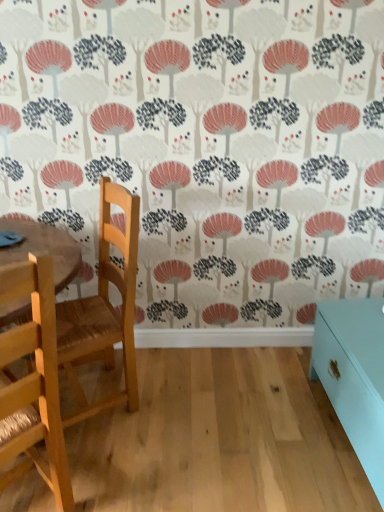
Question: Can you confirm if teal glossy cabinet at lower right is bigger than light wood chair at left, arranged as the 1th chair when viewed from the front?

Choices:
 (A) no
 (B) yes

Answer: (B)

Question: From the image's perspective, would you say teal glossy cabinet at lower right is positioned over light wood chair at left, arranged as the 1th chair when viewed from the front?

Choices:
 (A) yes
 (B) no

Answer: (B)

Question: Is teal glossy cabinet at lower right at the right side of light wood chair at left, the second chair positioned from the back?

Choices:
 (A) yes
 (B) no

Answer: (A)

Question: Is teal glossy cabinet at lower right to the left of light wood chair at left, arranged as the 1th chair when viewed from the front, from the viewer's perspective?

Choices:
 (A) yes
 (B) no

Answer: (B)

Question: Is light wood chair at left, arranged as the 1th chair when viewed from the front, located within teal glossy cabinet at lower right?

Choices:
 (A) yes
 (B) no

Answer: (B)

Question: Considering the positions of point (72, 329) and point (31, 394), is point (72, 329) closer or farther from the camera than point (31, 394)?

Choices:
 (A) farther
 (B) closer

Answer: (A)

Question: Relative to light wood chair at left, the second chair positioned from the back, is wooden chair at left, which is counted as the first chair, starting from the back, in front or behind?

Choices:
 (A) front
 (B) behind

Answer: (B)

Question: Is wooden chair at left, which is counted as the first chair, starting from the back, inside or outside of light wood chair at left, arranged as the 1th chair when viewed from the front?

Choices:
 (A) outside
 (B) inside

Answer: (A)

Question: Is wooden chair at left, which appears as the second chair when viewed from the front, to the left or to the right of light wood chair at left, arranged as the 1th chair when viewed from the front, in the image?

Choices:
 (A) left
 (B) right

Answer: (B)

Question: From a real-world perspective, is wooden chair at left, which appears as the second chair when viewed from the front, above or below teal glossy cabinet at lower right?

Choices:
 (A) above
 (B) below

Answer: (A)

Question: From the image's perspective, is wooden chair at left, which appears as the second chair when viewed from the front, located above or below teal glossy cabinet at lower right?

Choices:
 (A) below
 (B) above

Answer: (B)

Question: Considering the positions of wooden chair at left, which is counted as the first chair, starting from the back, and teal glossy cabinet at lower right in the image, is wooden chair at left, which is counted as the first chair, starting from the back, taller or shorter than teal glossy cabinet at lower right?

Choices:
 (A) short
 (B) tall

Answer: (B)

Question: Choose the correct answer: Is wooden chair at left, which appears as the second chair when viewed from the front, inside teal glossy cabinet at lower right or outside it?

Choices:
 (A) inside
 (B) outside

Answer: (B)

Question: Considering the positions of light wood chair at left, arranged as the 1th chair when viewed from the front, and teal glossy cabinet at lower right in the image, is light wood chair at left, arranged as the 1th chair when viewed from the front, bigger or smaller than teal glossy cabinet at lower right?

Choices:
 (A) big
 (B) small

Answer: (B)

Question: Choose the correct answer: Is light wood chair at left, arranged as the 1th chair when viewed from the front, inside teal glossy cabinet at lower right or outside it?

Choices:
 (A) outside
 (B) inside

Answer: (A)